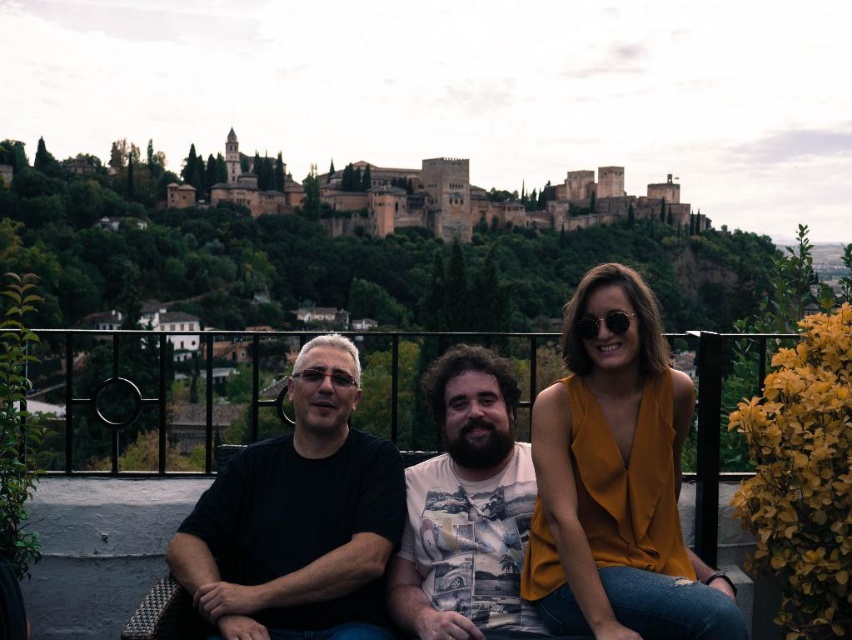
Question: Among these points, which one is farthest from the camera?

Choices:
 (A) pos(413,477)
 (B) pos(557,554)
 (C) pos(286,449)
 (D) pos(712,412)

Answer: (C)

Question: Which of the following is the farthest from the observer?

Choices:
 (A) black matte shirt at center
 (B) black metal railing at center
 (C) mustard fabric blouse at center
 (D) white printed t-shirt at center

Answer: (B)

Question: Is mustard fabric blouse at center above black matte shirt at center?

Choices:
 (A) no
 (B) yes

Answer: (A)

Question: Is mustard fabric blouse at center below black matte shirt at center?

Choices:
 (A) no
 (B) yes

Answer: (B)

Question: Which point appears farthest from the camera in this image?

Choices:
 (A) (371, 586)
 (B) (573, 449)

Answer: (B)

Question: Is black matte shirt at center thinner than white printed t-shirt at center?

Choices:
 (A) yes
 (B) no

Answer: (B)